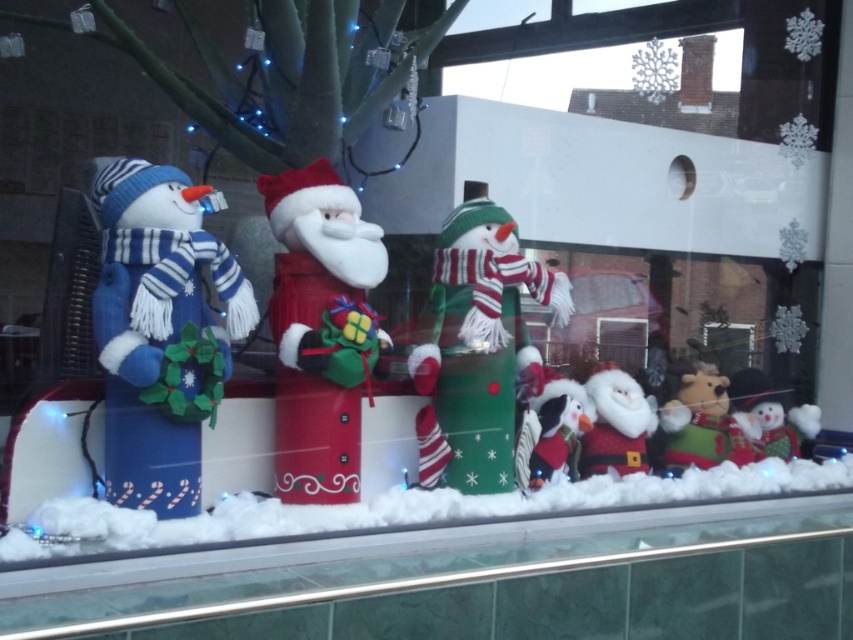
Question: Estimate the real-world distances between objects in this image. Which object is farther from the fuzzy fabric penguin at center?

Choices:
 (A) white frosted glass at lower center
 (B) green fabric snowman at center
 (C) velvet red santa at center

Answer: (C)

Question: Can you confirm if white plush santa at center is positioned to the left of white plush snowman at lower right?

Choices:
 (A) no
 (B) yes

Answer: (B)

Question: Is white frosted glass at lower center below white plush snowman at lower right?

Choices:
 (A) no
 (B) yes

Answer: (B)

Question: Observing the image, what is the correct spatial positioning of fuzzy brown reindeer at center in reference to fuzzy fabric penguin at center?

Choices:
 (A) below
 (B) above

Answer: (A)

Question: Which point is closer to the camera taking this photo?

Choices:
 (A) (624, 397)
 (B) (782, 451)
 (C) (720, 396)

Answer: (A)

Question: Which object appears closest to the camera in this image?

Choices:
 (A) blue plush snowman at left
 (B) fuzzy fabric penguin at center

Answer: (A)